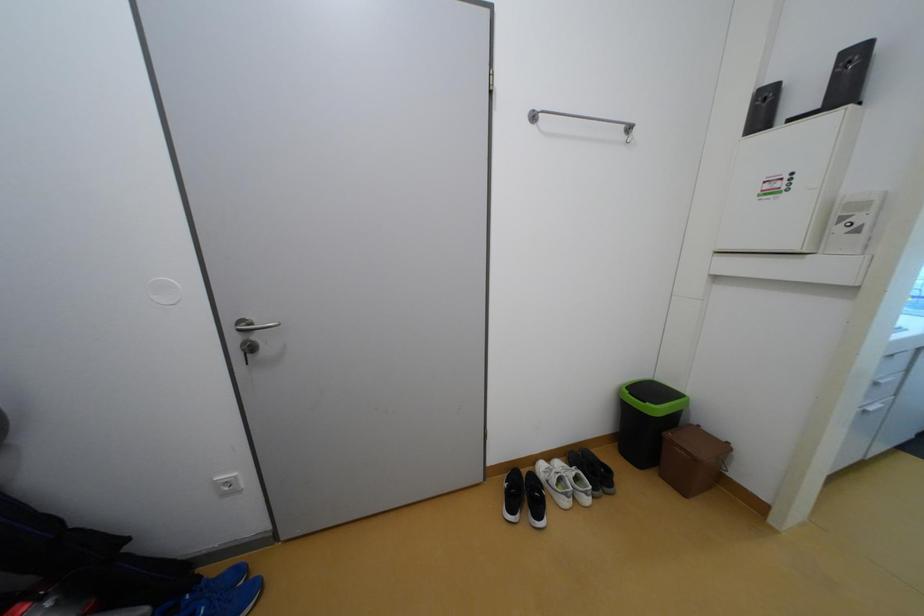
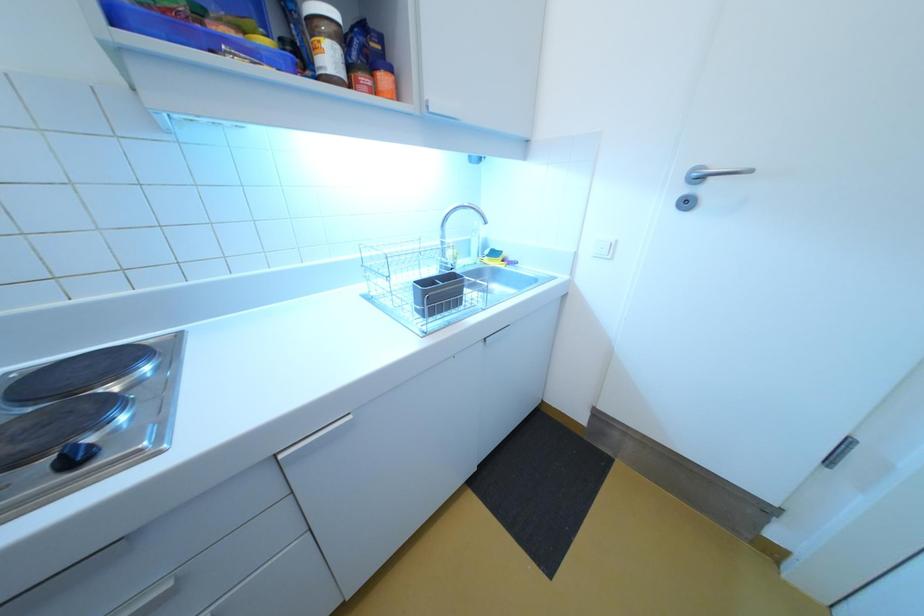
Question: In a continuous first-person perspective shot, in which direction is the camera moving?

Choices:
 (A) Left
 (B) Right
 (C) Forward
 (D) Backward

Answer: (B)